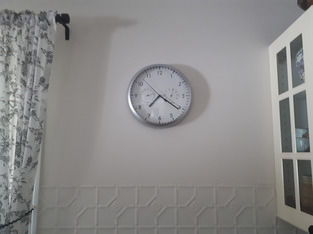
Locate an element on the screen. curtains is located at coordinates (32, 69), (14, 118).